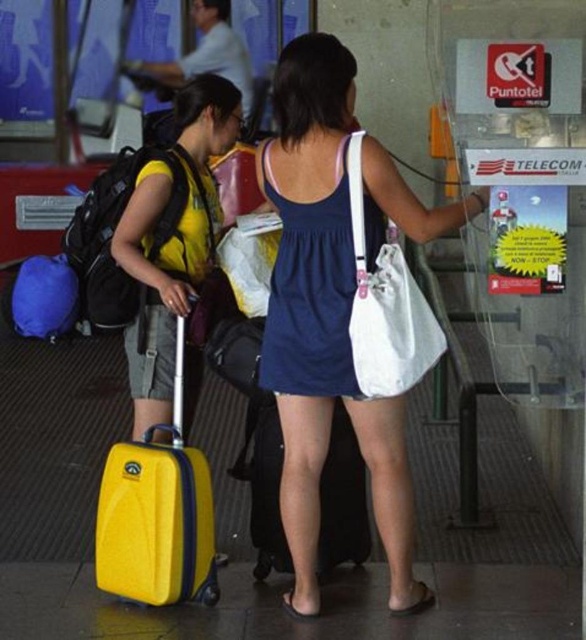
Question: Does yellow matte suitcase at left appear on the left side of yellow hardshell suitcase at lower left?

Choices:
 (A) no
 (B) yes

Answer: (B)

Question: Which object appears closest to the camera in this image?

Choices:
 (A) yellow hardshell suitcase at lower left
 (B) yellow matte suitcase at lower left
 (C) white canvas bag at center

Answer: (C)

Question: Can you confirm if white fabric bag at center is positioned above yellow hardshell suitcase at lower left?

Choices:
 (A) no
 (B) yes

Answer: (B)

Question: Does white canvas bag at center have a lesser width compared to white fabric bag at center?

Choices:
 (A) yes
 (B) no

Answer: (B)

Question: Which object is positioned farthest from the matte black backpack at left?

Choices:
 (A) white canvas bag at center
 (B) white fabric bag at center
 (C) yellow matte suitcase at lower left

Answer: (B)

Question: Which point is closer to the camera?

Choices:
 (A) yellow matte suitcase at left
 (B) yellow hardshell suitcase at lower left
 (C) yellow matte suitcase at lower left

Answer: (C)